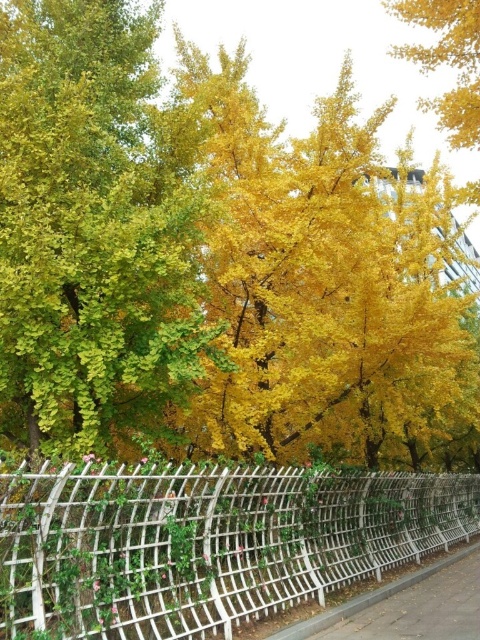
Question: Does white lattice fence at center appear on the right side of gray concrete pavement at lower center?

Choices:
 (A) no
 (B) yes

Answer: (A)

Question: Can you confirm if golden yellow leaves at center is positioned to the right of gray concrete pavement at lower center?

Choices:
 (A) no
 (B) yes

Answer: (A)

Question: Which point is farther from the camera taking this photo?

Choices:
 (A) (64, 96)
 (B) (361, 625)
 (C) (73, 557)

Answer: (B)

Question: Estimate the real-world distances between objects in this image. Which object is closer to the golden yellow leaves at center?

Choices:
 (A) white lattice fence at center
 (B) gray concrete pavement at lower center

Answer: (A)

Question: Is golden yellow leaves at center below white lattice fence at center?

Choices:
 (A) yes
 (B) no

Answer: (B)

Question: Which of the following is the closest to the observer?

Choices:
 (A) (421, 602)
 (B) (182, 600)

Answer: (B)